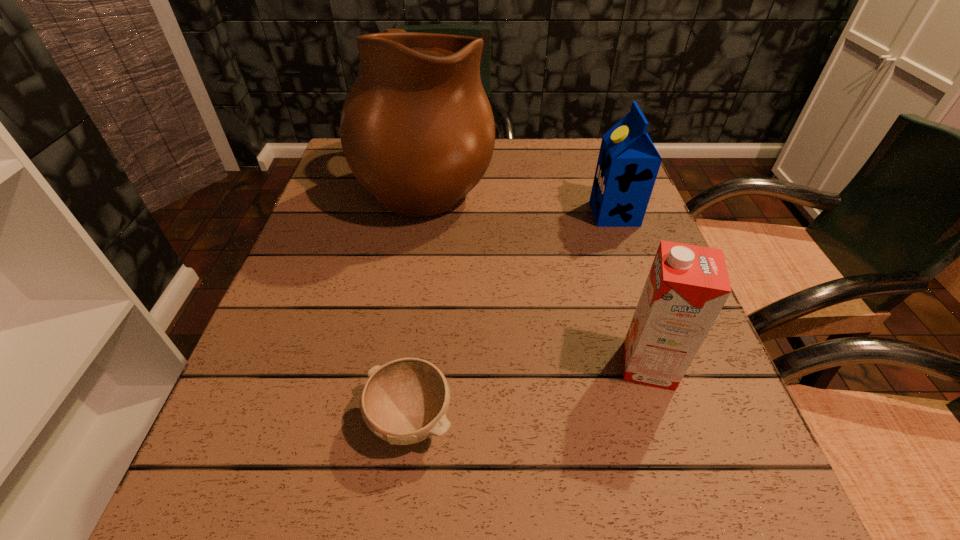
Locate an element on the screen. The width and height of the screenshot is (960, 540). cream pitcher is located at coordinates (417, 130).

Locate an element on the screen. the farther carton is located at coordinates (628, 163).

This screenshot has width=960, height=540. I want to click on the nearer carton, so click(687, 286).

What are the coordinates of `bowl` in the screenshot? It's located at (405, 401).

Where is `free space located 0.050m at the spout of the cream pitcher`? The height and width of the screenshot is (540, 960). free space located 0.050m at the spout of the cream pitcher is located at coordinates (513, 183).

Locate an element on the screen. Image resolution: width=960 pixels, height=540 pixels. vacant space located with the cap open on the farther carton is located at coordinates (472, 213).

This screenshot has height=540, width=960. Find the location of `vacant space located with the cap open on the farther carton`. vacant space located with the cap open on the farther carton is located at coordinates (549, 213).

Identify the location of free location located with the cap open on the farther carton. The width and height of the screenshot is (960, 540). (493, 213).

I want to click on vacant space located on the front of the nearer carton, so click(x=670, y=434).

Locate an element on the screen. This screenshot has height=540, width=960. vacant space located on the back of the bowl is located at coordinates (422, 329).